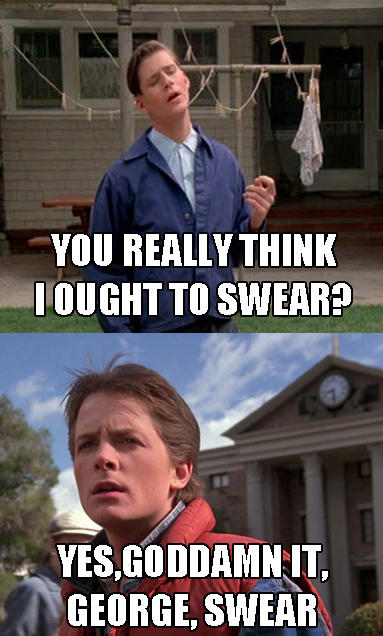
What are the coordinates of `clock` in the screenshot? It's located at (331, 389).